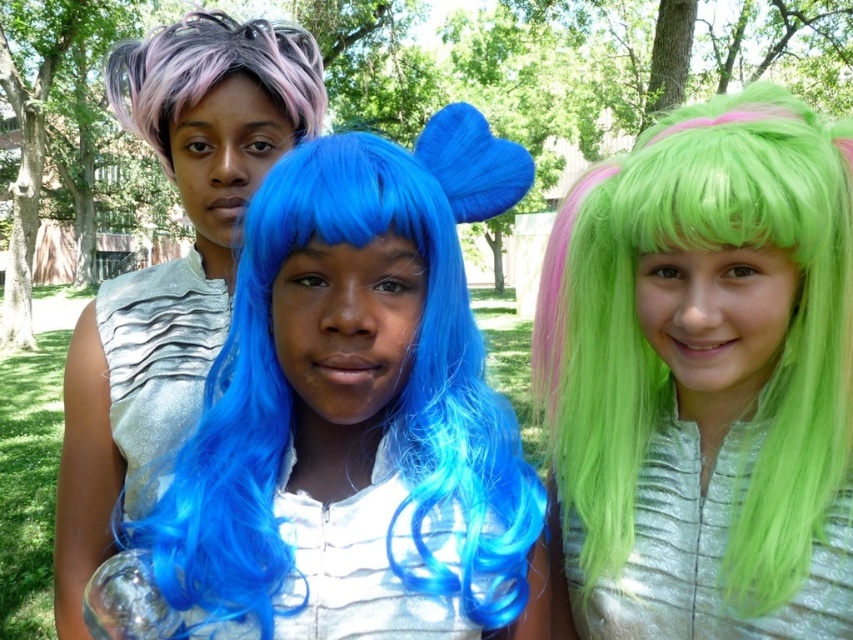
You are a fashion designer who wants to place a new accessory on the matte silver dress at center. The coordinate system is normalized, with the origin at the bottom left corner of the image. The point at coordinate (171, 262) is where you want to place the accessory. Is this coordinate on the matte silver dress at center?

Yes, the point at coordinate (171, 262) is on the matte silver dress at center because the Objects Description states that this coordinate corresponds to the matte silver dress at center.

You are a photographer setting up for a group photo. You need to position the matte silver dress at center and the pastel purple dreadlocks at upper left in the frame. Based on their positions, which object should be placed closer to the left side of the camera frame?

The pastel purple dreadlocks at upper left should be placed closer to the left side of the camera frame because the matte silver dress at center is to the right of it.

You are a photographer setting up for a photoshoot in a park. You have two props to place in the frame, the neon green wig at center and the matte silver dress at center. According to the scene, where should you place the neon green wig relative to the matte silver dress?

The neon green wig at center should be placed under the matte silver dress at center as per the scene description.